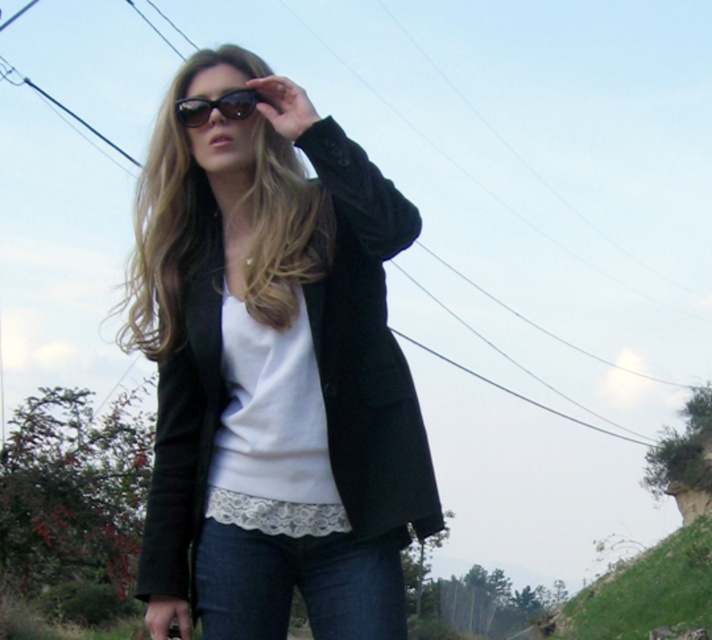
Question: Does denim jeans at lower center have a greater width compared to black plastic sunglasses at upper center?

Choices:
 (A) yes
 (B) no

Answer: (A)

Question: Is black velvet jacket at center positioned in front of black plastic sunglasses at upper center?

Choices:
 (A) no
 (B) yes

Answer: (B)

Question: Which object is positioned farthest from the black plastic sunglasses at upper center?

Choices:
 (A) black velvet jacket at center
 (B) denim jeans at lower center

Answer: (B)

Question: Which point appears closest to the camera in this image?

Choices:
 (A) (408, 209)
 (B) (199, 120)
 (C) (214, 620)

Answer: (C)

Question: Is denim jeans at lower center thinner than black plastic sunglasses at upper center?

Choices:
 (A) no
 (B) yes

Answer: (A)

Question: Which of the following is the closest to the observer?

Choices:
 (A) black velvet jacket at center
 (B) denim jeans at lower center

Answer: (A)